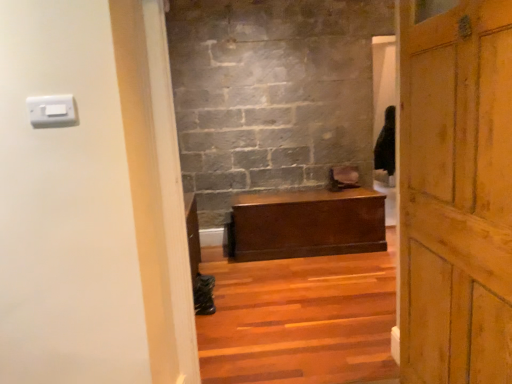
Question: Is white plastic light switch at upper left aimed at matte brown wooden chest at center?

Choices:
 (A) no
 (B) yes

Answer: (A)

Question: Does white plastic light switch at upper left have a lesser width compared to matte brown wooden chest at center?

Choices:
 (A) no
 (B) yes

Answer: (B)

Question: Is matte brown wooden chest at center a part of white plastic light switch at upper left?

Choices:
 (A) yes
 (B) no

Answer: (B)

Question: Is white plastic light switch at upper left wider than matte brown wooden chest at center?

Choices:
 (A) yes
 (B) no

Answer: (B)

Question: From the image's perspective, is white plastic light switch at upper left located beneath matte brown wooden chest at center?

Choices:
 (A) yes
 (B) no

Answer: (B)

Question: Is white plastic light switch at upper left wider or thinner than wooden door at right?

Choices:
 (A) thin
 (B) wide

Answer: (A)

Question: Is point (52, 119) closer or farther from the camera than point (498, 336)?

Choices:
 (A) closer
 (B) farther

Answer: (B)

Question: From a real-world perspective, is white plastic light switch at upper left above or below wooden door at right?

Choices:
 (A) below
 (B) above

Answer: (B)

Question: Visually, is white plastic light switch at upper left positioned to the left or to the right of wooden door at right?

Choices:
 (A) left
 (B) right

Answer: (A)

Question: From a real-world perspective, is wooden door at right positioned above or below white plastic light switch at upper left?

Choices:
 (A) above
 (B) below

Answer: (B)

Question: Is point (422, 380) closer or farther from the camera than point (65, 122)?

Choices:
 (A) closer
 (B) farther

Answer: (B)

Question: Considering the relative positions of wooden door at right and white plastic light switch at upper left in the image provided, is wooden door at right to the left or to the right of white plastic light switch at upper left?

Choices:
 (A) left
 (B) right

Answer: (B)

Question: Is wooden door at right spatially inside white plastic light switch at upper left, or outside of it?

Choices:
 (A) outside
 (B) inside

Answer: (A)

Question: Would you say wooden door at right is inside or outside matte brown wooden chest at center?

Choices:
 (A) inside
 (B) outside

Answer: (B)

Question: Considering the positions of point click(486, 359) and point click(315, 251), is point click(486, 359) closer or farther from the camera than point click(315, 251)?

Choices:
 (A) farther
 (B) closer

Answer: (B)